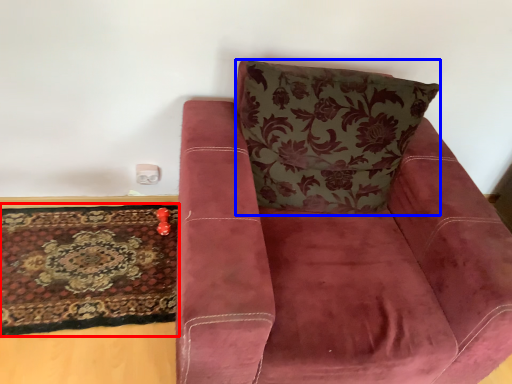
Question: Which object appears closest to the camera in this image, mat (highlighted by a red box) or throw pillow (highlighted by a blue box)?

Choices:
 (A) mat
 (B) throw pillow

Answer: (B)